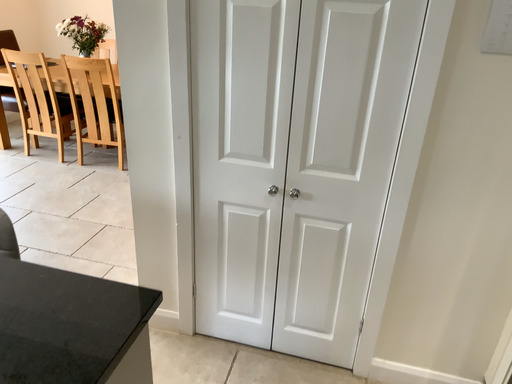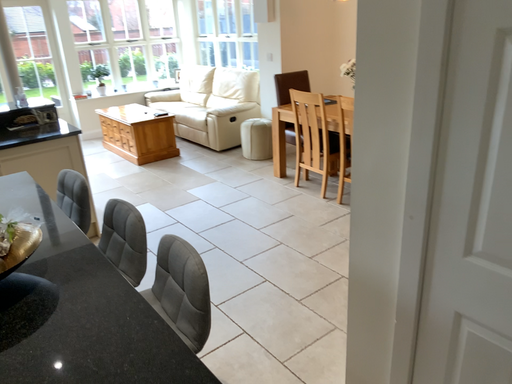
Question: How did the camera likely rotate when shooting the video?

Choices:
 (A) rotated upward
 (B) rotated downward

Answer: (A)